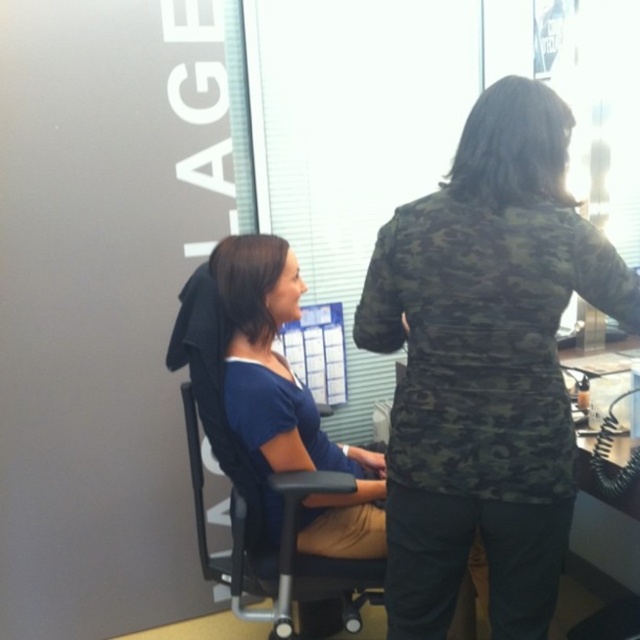
Who is positioned more to the left, camo-patterned shirt at back or black plastic swivel chair at center?

black plastic swivel chair at center

Which is behind, point (499, 492) or point (209, 420)?

Positioned behind is point (209, 420).

The height and width of the screenshot is (640, 640). I want to click on camo-patterned shirt at back, so click(484, 364).